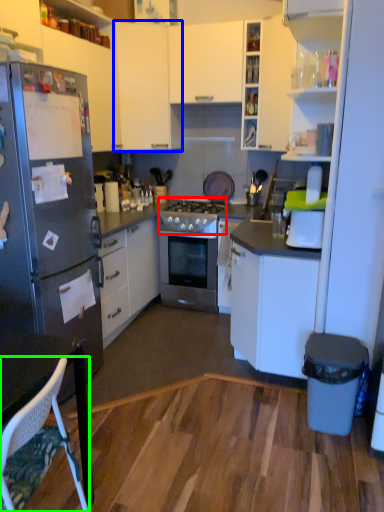
Question: Which is nearer to the gas stove (highlighted by a red box)? cabinetry (highlighted by a blue box) or chair (highlighted by a green box).

Choices:
 (A) cabinetry
 (B) chair

Answer: (A)